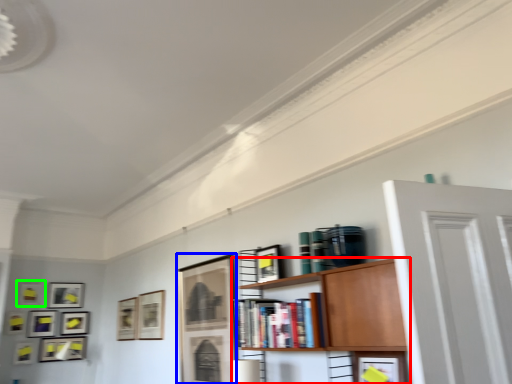
Question: Which object is positioned farthest from shelf (highlighted by a red box)? Select from picture frame (highlighted by a blue box) and picture frame (highlighted by a green box).

Choices:
 (A) picture frame
 (B) picture frame

Answer: (B)